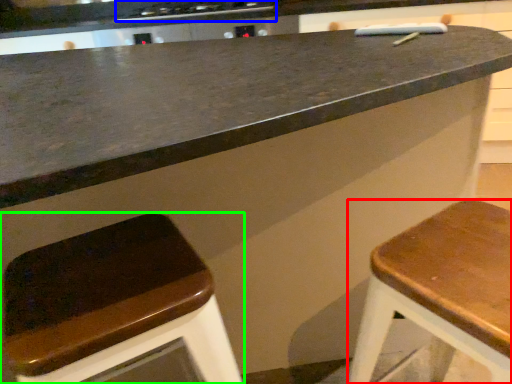
Question: Which object is positioned closest to stool (highlighted by a red box)? Select from stove (highlighted by a blue box) and stool (highlighted by a green box).

Choices:
 (A) stove
 (B) stool

Answer: (B)